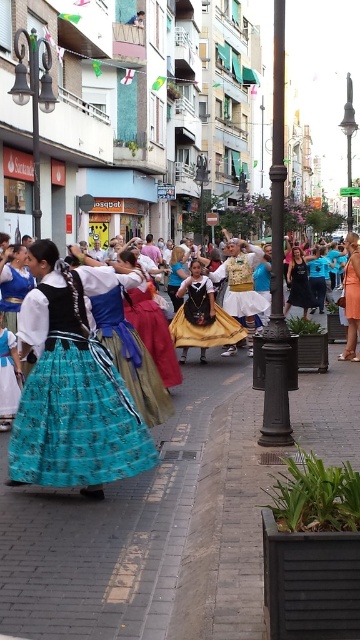
Is blue satin dress at lower left above white cotton dress at center?

Incorrect, blue satin dress at lower left is not positioned above white cotton dress at center.

Is point (6, 404) closer to camera compared to point (266, 296)?

Yes.

The height and width of the screenshot is (640, 360). I want to click on blue satin dress at lower left, so (x=9, y=378).

Does turquoise fabric skirt at lower left have a smaller size compared to orange fabric dress at center?

Yes.

Is point (150, 452) farther from camera compared to point (352, 248)?

No, it is in front of (352, 248).

Between point (56, 426) and point (353, 294), which one is positioned in front?

Point (56, 426)

This screenshot has width=360, height=640. What are the coordinates of `turquoise fabric skirt at lower left` in the screenshot? It's located at (72, 387).

Between point (354, 272) and point (182, 264), which one is positioned in front?

Point (354, 272) is in front.

Between point (352, 300) and point (183, 266), which one is positioned in front?

Point (352, 300)

Where is `orange fabric dress at center`? orange fabric dress at center is located at coordinates (352, 298).